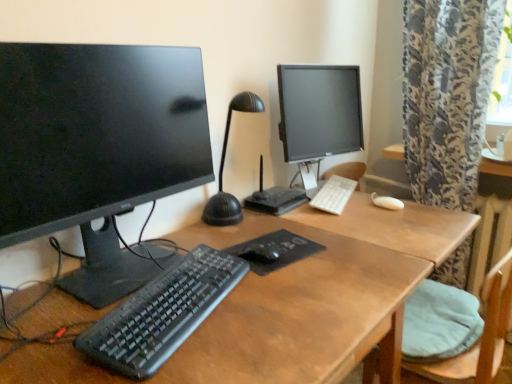
Identify the location of free space to the right of white plastic keyboard at center, which is counted as the first computer keyboard, starting from the top. (x=377, y=198).